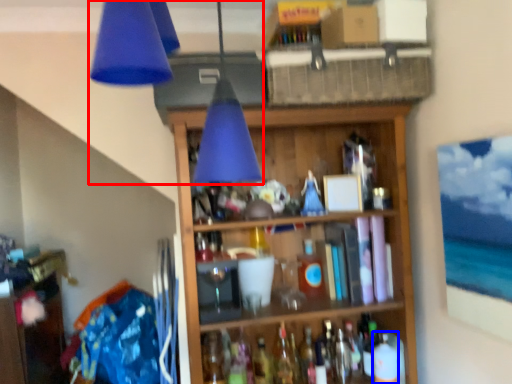
Question: Which point is further to the camera, lamp (highlighted by a red box) or bottle (highlighted by a blue box)?

Choices:
 (A) lamp
 (B) bottle

Answer: (B)